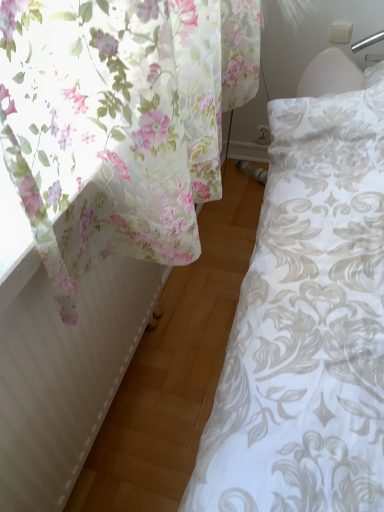
Question: Is floral fabric curtain at left bigger than white textured radiator at left?

Choices:
 (A) no
 (B) yes

Answer: (B)

Question: Is floral fabric curtain at left to the right of white textured radiator at left from the viewer's perspective?

Choices:
 (A) no
 (B) yes

Answer: (A)

Question: Is floral fabric curtain at left taller than white textured radiator at left?

Choices:
 (A) yes
 (B) no

Answer: (B)

Question: From the image's perspective, would you say floral fabric curtain at left is positioned over white textured radiator at left?

Choices:
 (A) no
 (B) yes

Answer: (B)

Question: From a real-world perspective, is floral fabric curtain at left physically below white textured radiator at left?

Choices:
 (A) no
 (B) yes

Answer: (A)

Question: Does floral fabric curtain at left come in front of white textured radiator at left?

Choices:
 (A) no
 (B) yes

Answer: (A)

Question: Is white textured radiator at left at the right side of floral fabric curtain at left?

Choices:
 (A) no
 (B) yes

Answer: (B)

Question: Would you say white textured radiator at left is a long distance from floral fabric curtain at left?

Choices:
 (A) yes
 (B) no

Answer: (B)

Question: Considering the relative sizes of white textured radiator at left and floral fabric curtain at left in the image provided, is white textured radiator at left taller than floral fabric curtain at left?

Choices:
 (A) yes
 (B) no

Answer: (A)

Question: Does white textured radiator at left have a greater width compared to floral fabric curtain at left?

Choices:
 (A) yes
 (B) no

Answer: (B)

Question: From the image's perspective, is white textured radiator at left below floral fabric curtain at left?

Choices:
 (A) yes
 (B) no

Answer: (A)

Question: Is white textured radiator at left turned away from floral fabric curtain at left?

Choices:
 (A) no
 (B) yes

Answer: (A)

Question: Is white textured radiator at left in front of or behind floral fabric curtain at left in the image?

Choices:
 (A) front
 (B) behind

Answer: (A)